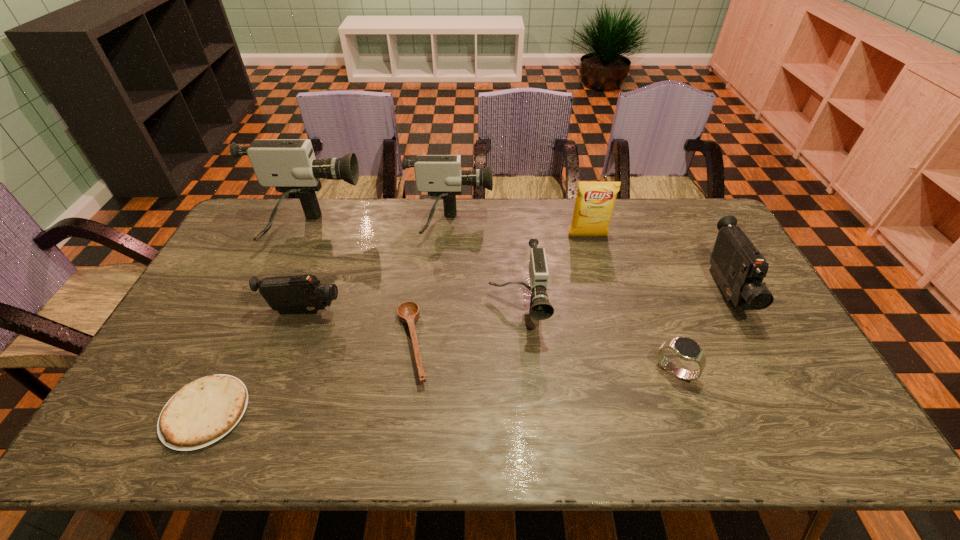
Where is `object that is at the near left corner`? The height and width of the screenshot is (540, 960). object that is at the near left corner is located at coordinates (202, 412).

Identify the location of vacant space at the far edge. Image resolution: width=960 pixels, height=540 pixels. (346, 202).

In the image, there is a desktop. At what (x,y) coordinates should I click in order to perform the action: click on free space at the near edge. Please return your answer as a coordinate pair (x, y). The height and width of the screenshot is (540, 960). Looking at the image, I should click on (427, 438).

This screenshot has height=540, width=960. Identify the location of free space at the left edge of the desktop. (215, 347).

The width and height of the screenshot is (960, 540). In the image, there is a desktop. What are the coordinates of `vacant space at the right edge` in the screenshot? It's located at (730, 318).

The height and width of the screenshot is (540, 960). I want to click on vacant space at the far right corner of the desktop, so click(x=713, y=229).

The width and height of the screenshot is (960, 540). Identify the location of blank region between the nearest white camcorder and the beige tortilla. (361, 361).

I want to click on vacant area that lies between the fourth shortest camcorder and the fourth shortest object, so click(x=377, y=269).

The width and height of the screenshot is (960, 540). Identify the location of blank region between the second smallest white camcorder and the shortest object. (327, 320).

Find the location of `free space between the bigger black camcorder and the second tallest camcorder`. free space between the bigger black camcorder and the second tallest camcorder is located at coordinates (588, 259).